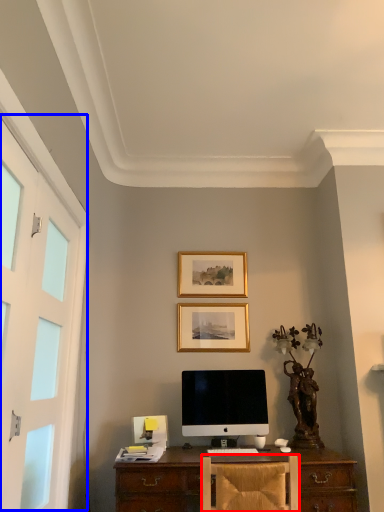
Question: Which object is further to the camera taking this photo, chair (highlighted by a red box) or screen door (highlighted by a blue box)?

Choices:
 (A) chair
 (B) screen door

Answer: (A)